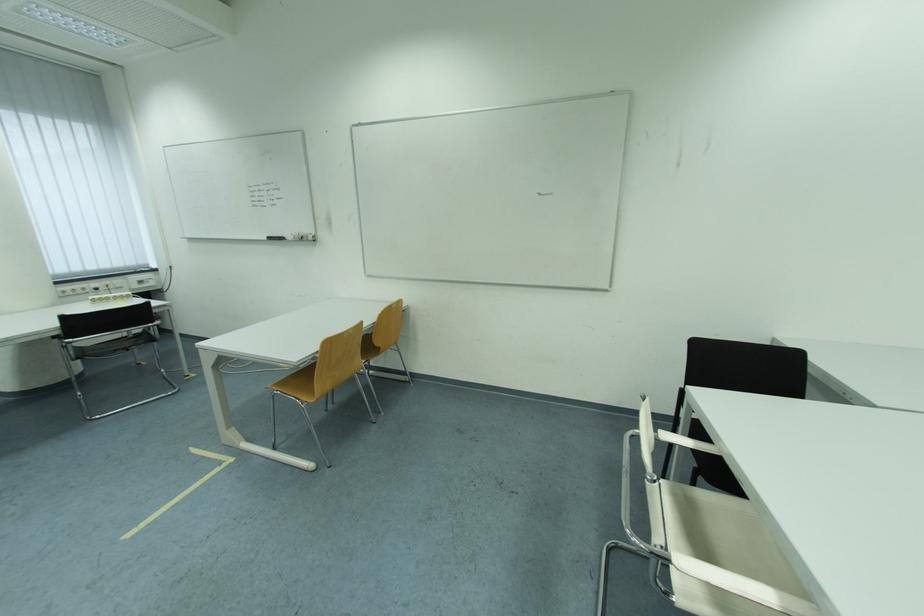
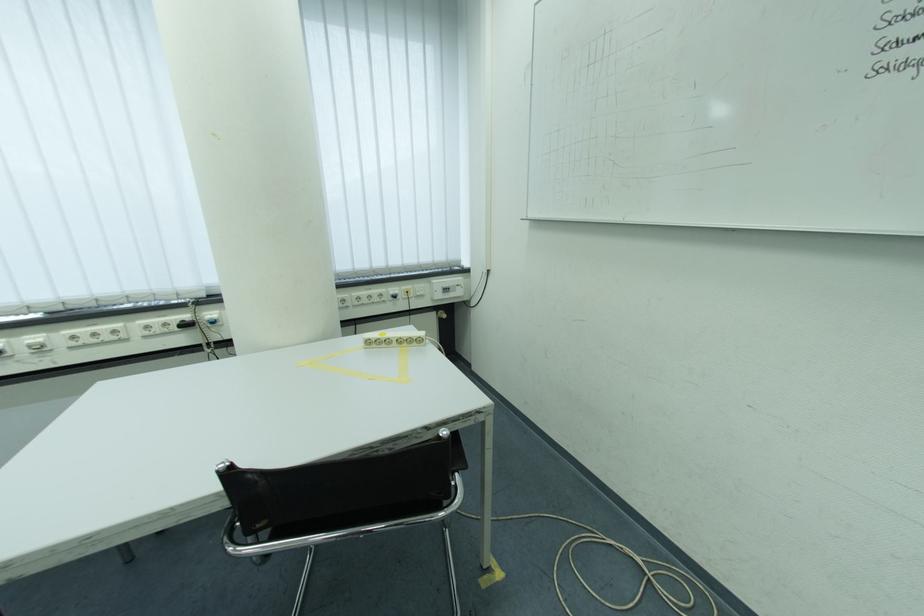
In the second image, find the point that corresponds to pixel 73 294 in the first image.

(368, 301)